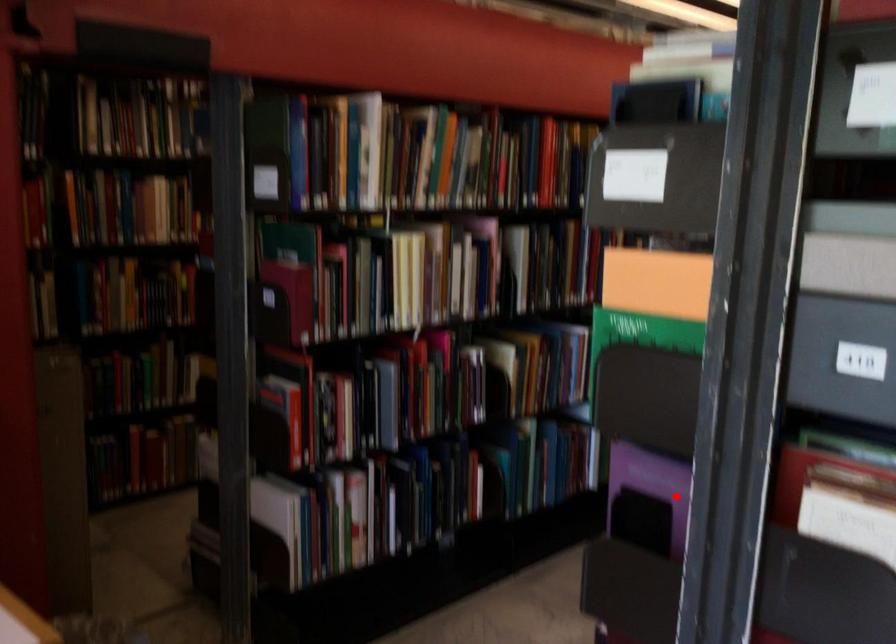
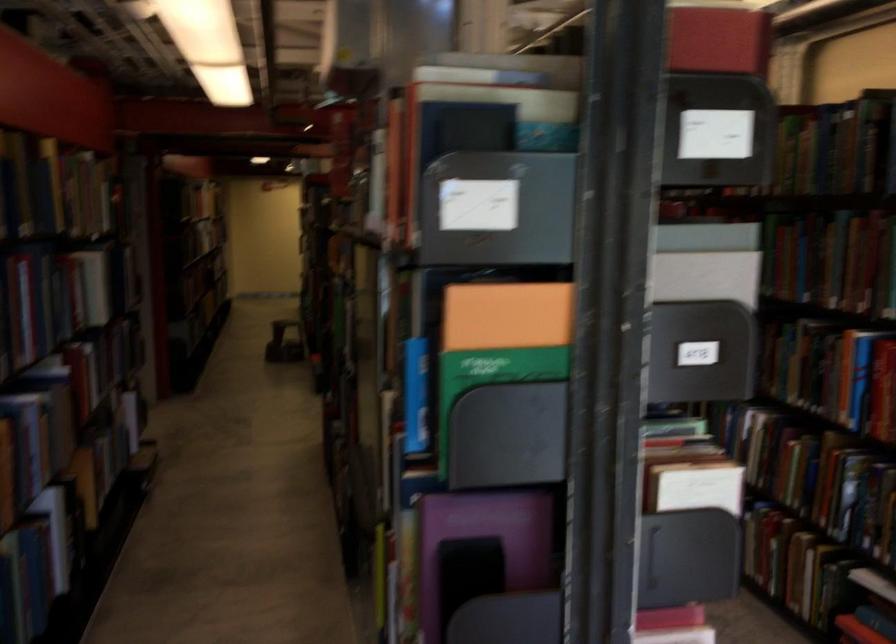
Find the pixel in the second image that matches the highlighted location in the first image.

(489, 532)